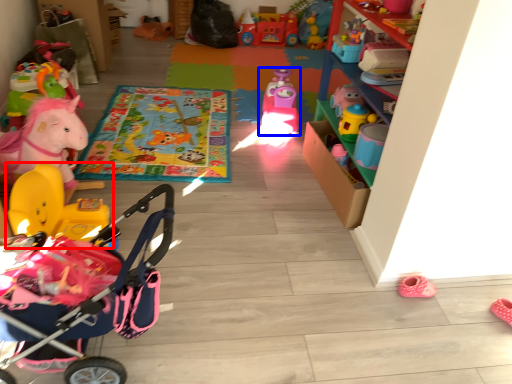
Question: Which object is further to the camera taking this photo, toy (highlighted by a red box) or toy (highlighted by a blue box)?

Choices:
 (A) toy
 (B) toy

Answer: (B)